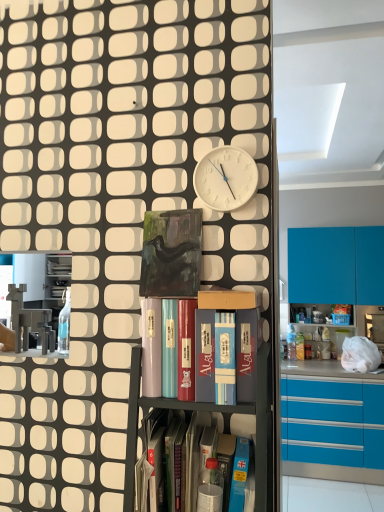
The width and height of the screenshot is (384, 512). Describe the element at coordinates (113, 204) in the screenshot. I see `blue glossy cupboard at center` at that location.

Where is `metallic gray bookshelf at center, the fourth shelf from the left`? Image resolution: width=384 pixels, height=512 pixels. metallic gray bookshelf at center, the fourth shelf from the left is located at coordinates (189, 438).

Identify the location of matte cardboard box at center, placed as the second shelf when sorted from right to left. 234,342.

What do you see at coordinates (226, 178) in the screenshot?
I see `white matte clock at upper center` at bounding box center [226, 178].

Where is `blue glossy cupboard at center`? blue glossy cupboard at center is located at coordinates (113, 204).

Based on their sizes in the image, would you say green glass book at center is bigger or smaller than metallic gray shelf at left, placed as the fourth shelf when sorted from right to left?

Clearly, green glass book at center is smaller in size than metallic gray shelf at left, placed as the fourth shelf when sorted from right to left.

Which point is more distant from viewer, [194,240] or [55,294]?

Point [55,294]

From the picture: Is green glass book at center in front of or behind metallic gray shelf at left, placed as the fourth shelf when sorted from right to left, in the image?

green glass book at center is positioned closer to the viewer than metallic gray shelf at left, placed as the fourth shelf when sorted from right to left.

Is green glass book at center far from metallic gray shelf at left, which is the 1th shelf in left-to-right order?

Yes, green glass book at center and metallic gray shelf at left, which is the 1th shelf in left-to-right order, are quite far apart.

You are a GUI agent. You are given a task and a screenshot of the screen. Output one action in this format:
    pyautogui.click(x=<x>, y=<y>)
    Task: Click on the wall clock above the metallic gray shelf at left, placed as the fourth shelf when sorted from right to left (from a real-world perspective)
    Image resolution: width=384 pixels, height=512 pixels.
    Given the screenshot: What is the action you would take?
    pyautogui.click(x=226, y=178)

From a real-world perspective, which object rests below the other?

From a 3D spatial view, metallic gray shelf at left, placed as the fourth shelf when sorted from right to left, is below.

Looking at this image, who is smaller, metallic gray shelf at left, which is the 1th shelf in left-to-right order, or white matte clock at upper center?

Smaller between the two is white matte clock at upper center.

Looking at this image, considering the sizes of metallic gray shelf at left, placed as the fourth shelf when sorted from right to left, and white matte clock at upper center in the image, is metallic gray shelf at left, placed as the fourth shelf when sorted from right to left, taller or shorter than white matte clock at upper center?

metallic gray shelf at left, placed as the fourth shelf when sorted from right to left, is taller than white matte clock at upper center.

Considering the positions of objects metallic gray bookshelf at center, which ranks as the second shelf in left-to-right order, and blue glossy cupboard at center in the image provided, who is in front, metallic gray bookshelf at center, which ranks as the second shelf in left-to-right order, or blue glossy cupboard at center?

Positioned in front is metallic gray bookshelf at center, which ranks as the second shelf in left-to-right order.

Between metallic gray bookshelf at center, which ranks as the second shelf in left-to-right order, and blue glossy cupboard at center, which one has larger size?

With larger size is metallic gray bookshelf at center, which ranks as the second shelf in left-to-right order.

In the scene shown: Would you say metallic gray bookshelf at center, which ranks as the second shelf in left-to-right order, contains blue glossy cupboard at center?

No.

Find the location of a particular element. The width and height of the screenshot is (384, 512). cupboard above the metallic gray bookshelf at center, which ranks as the second shelf in left-to-right order (from a real-world perspective) is located at coordinates (113, 204).

From a real-world perspective, which is physically above, blue glossy cupboard at center or white matte clock at upper center?

white matte clock at upper center, from a real-world perspective.

Which object is closer to the camera taking this photo, blue glossy cupboard at center or white matte clock at upper center?

Positioned in front is blue glossy cupboard at center.

Can you confirm if blue glossy cupboard at center is bigger than white matte clock at upper center?

Correct, blue glossy cupboard at center is larger in size than white matte clock at upper center.

Does green glass book at center turn towards white matte clock at upper center?

No, green glass book at center is not facing towards white matte clock at upper center.

Considering the relative positions of green glass book at center and white matte clock at upper center in the image provided, is green glass book at center behind white matte clock at upper center?

Yes, green glass book at center is behind white matte clock at upper center.

The width and height of the screenshot is (384, 512). What are the coordinates of `paperback book that appears below the white matte clock at upper center (from a real-world perspective)` in the screenshot? It's located at (171, 254).

Which is nearer, (168, 287) or (209, 176)?

Point (168, 287) appears to be closer to the viewer than point (209, 176).

Which is behind, blue glossy cupboard at center or metallic gray bookshelf at center, placed as the 1th shelf when sorted from right to left?

blue glossy cupboard at center is further from the camera.

From the image's perspective, would you say blue glossy cupboard at center is positioned over metallic gray bookshelf at center, the fourth shelf from the left?

Yes, from the image's perspective, blue glossy cupboard at center is over metallic gray bookshelf at center, the fourth shelf from the left.

From the picture: From a real-world perspective, is blue glossy cupboard at center physically located above or below metallic gray bookshelf at center, placed as the 1th shelf when sorted from right to left?

In terms of real-world spatial position, blue glossy cupboard at center is above metallic gray bookshelf at center, placed as the 1th shelf when sorted from right to left.

How far apart are blue glossy cupboard at center and metallic gray bookshelf at center, placed as the 1th shelf when sorted from right to left?

blue glossy cupboard at center is 58.20 centimeters away from metallic gray bookshelf at center, placed as the 1th shelf when sorted from right to left.

At what (x,y) coordinates should I click in order to perform the action: click on the 2nd shelf in front of the matte cardboard box at center, which is the third shelf in left-to-right order, counting from the anchor's position. Please return your answer as a coordinate pair (x, y). Looking at the image, I should click on (213, 383).

From the image's perspective, is metallic gray bookshelf at center, which is counted as the 3th shelf, starting from the right, positioned above or below matte cardboard box at center, placed as the second shelf when sorted from right to left?

metallic gray bookshelf at center, which is counted as the 3th shelf, starting from the right, is below matte cardboard box at center, placed as the second shelf when sorted from right to left.

Between metallic gray bookshelf at center, which ranks as the second shelf in left-to-right order, and matte cardboard box at center, placed as the second shelf when sorted from right to left, which one has larger size?

metallic gray bookshelf at center, which ranks as the second shelf in left-to-right order.

Which object is positioned more to the left, metallic gray bookshelf at center, which is counted as the 3th shelf, starting from the right, or matte cardboard box at center, which is the third shelf in left-to-right order?

Positioned to the left is metallic gray bookshelf at center, which is counted as the 3th shelf, starting from the right.

The image size is (384, 512). What are the coordinates of `shelf that appears on the left of green glass book at center` in the screenshot? It's located at (42, 304).

What are the coordinates of `wall clock that is on the right side of metallic gray shelf at left, placed as the fourth shelf when sorted from right to left` in the screenshot? It's located at [x=226, y=178].

From the picture: Looking at the image, which one is located closer to metallic gray bookshelf at center, which is counted as the 3th shelf, starting from the right, blue glossy cupboard at center or metallic gray shelf at left, placed as the fourth shelf when sorted from right to left?

blue glossy cupboard at center lies closer to metallic gray bookshelf at center, which is counted as the 3th shelf, starting from the right, than the other object.

Estimate the real-world distances between objects in this image. Which object is further from white matte clock at upper center, green glass book at center or blue glossy cupboard at center?

blue glossy cupboard at center lies further to white matte clock at upper center than the other object.

When comparing their distances from blue glossy cupboard at center, does matte cardboard box at center, placed as the second shelf when sorted from right to left, or metallic gray shelf at left, which is the 1th shelf in left-to-right order, seem closer?

matte cardboard box at center, placed as the second shelf when sorted from right to left.

From the image, which object appears to be farther from metallic gray shelf at left, which is the 1th shelf in left-to-right order, matte cardboard box at center, which is the third shelf in left-to-right order, or white matte clock at upper center?

The object further to metallic gray shelf at left, which is the 1th shelf in left-to-right order, is matte cardboard box at center, which is the third shelf in left-to-right order.

From the image, which object appears to be nearer to metallic gray bookshelf at center, which ranks as the second shelf in left-to-right order, white matte clock at upper center or metallic gray bookshelf at center, placed as the 1th shelf when sorted from right to left?

The object closer to metallic gray bookshelf at center, which ranks as the second shelf in left-to-right order, is metallic gray bookshelf at center, placed as the 1th shelf when sorted from right to left.

Based on their spatial positions, is blue glossy cupboard at center or metallic gray bookshelf at center, placed as the 1th shelf when sorted from right to left, closer to white matte clock at upper center?

blue glossy cupboard at center is positioned closer to the anchor white matte clock at upper center.

From the image, which object appears to be farther from metallic gray bookshelf at center, which ranks as the second shelf in left-to-right order, blue glossy cupboard at center or metallic gray bookshelf at center, placed as the 1th shelf when sorted from right to left?

blue glossy cupboard at center is positioned further to the anchor metallic gray bookshelf at center, which ranks as the second shelf in left-to-right order.

Estimate the real-world distances between objects in this image. Which object is further from metallic gray bookshelf at center, which is counted as the 3th shelf, starting from the right, metallic gray bookshelf at center, placed as the 1th shelf when sorted from right to left, or green glass book at center?

green glass book at center lies further to metallic gray bookshelf at center, which is counted as the 3th shelf, starting from the right, than the other object.

You are a GUI agent. You are given a task and a screenshot of the screen. Output one action in this format:
    pyautogui.click(x=<x>, y=<y>)
    Task: Click on the paperback book between blue glossy cupboard at center and metallic gray bookshelf at center, placed as the 1th shelf when sorted from right to left, in the vertical direction
    
    Given the screenshot: What is the action you would take?
    pyautogui.click(x=171, y=254)

The image size is (384, 512). Identify the location of shelf located between metallic gray shelf at left, placed as the fourth shelf when sorted from right to left, and matte cardboard box at center, placed as the second shelf when sorted from right to left, in the left-right direction. (213, 383).

At what (x,y) coordinates should I click in order to perform the action: click on cupboard situated between metallic gray shelf at left, placed as the fourth shelf when sorted from right to left, and metallic gray bookshelf at center, which ranks as the second shelf in left-to-right order, from left to right. Please return your answer as a coordinate pair (x, y). Looking at the image, I should click on (113, 204).

Find the location of a particular element. Image resolution: width=384 pixels, height=512 pixels. paperback book that lies between blue glossy cupboard at center and matte cardboard box at center, which is the third shelf in left-to-right order, from top to bottom is located at coordinates pyautogui.click(x=171, y=254).